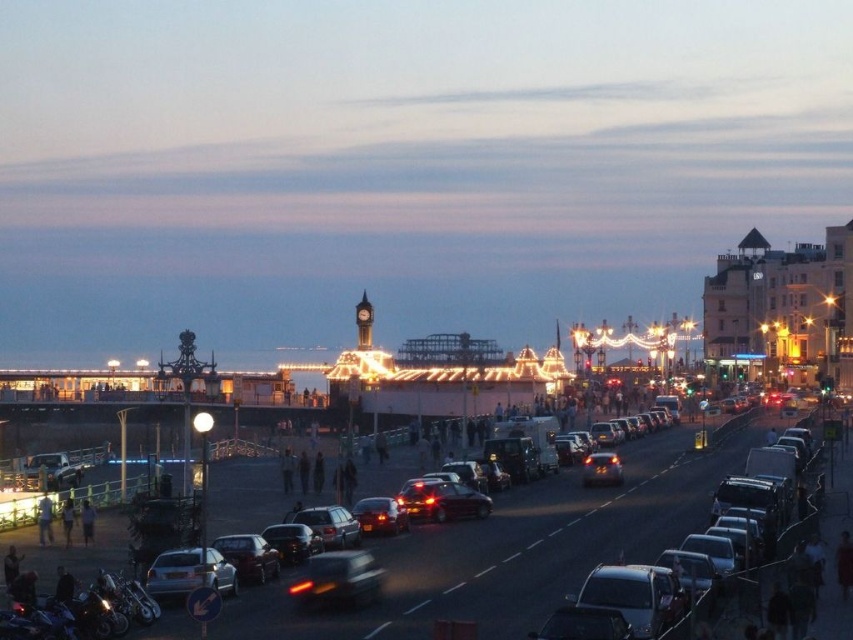
You are standing at the entrance of the seaside promenade and see the shiny black car at center. If you walk straight ahead, will you reach the sea or the road first?

The shiny black car at center is located at point (338, 579) in 2D coordinates. Since the road is in the foreground and the sea is in the background, the road is closer to you. Therefore, walking straight ahead, you would reach the road before the sea.

You are standing at the point marked by the coordinate point at (518,547) in the image. Looking around, what type of vehicles are located at the center of the scene?

The point at (518,547) indicates metallic cars at center, so the vehicles at the center are metallic cars.

You are standing on the seaside promenade and notice two cars in the center of the image. According to their positions, which one is closer to the horizon? The metallic cars at center or the silver metallic car at center?

The silver metallic car at center is closer to the horizon because the metallic cars at center is above it, meaning it is positioned in front, blocking the view to some extent. Therefore, the silver metallic car at center is behind and nearer to the horizon.